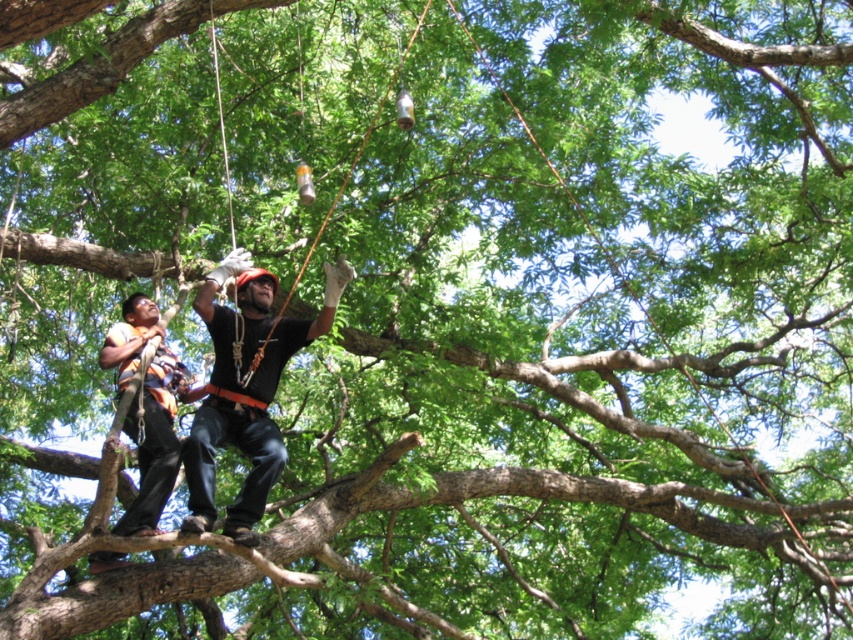
Can you confirm if black matte shirt at center is positioned to the right of orange safety vest at center?

Indeed, black matte shirt at center is positioned on the right side of orange safety vest at center.

Does black matte shirt at center have a greater height compared to orange safety vest at center?

Yes.

At what (x,y) coordinates should I click in order to perform the action: click on black matte shirt at center. Please return your answer as a coordinate pair (x, y). Looking at the image, I should click on (245, 388).